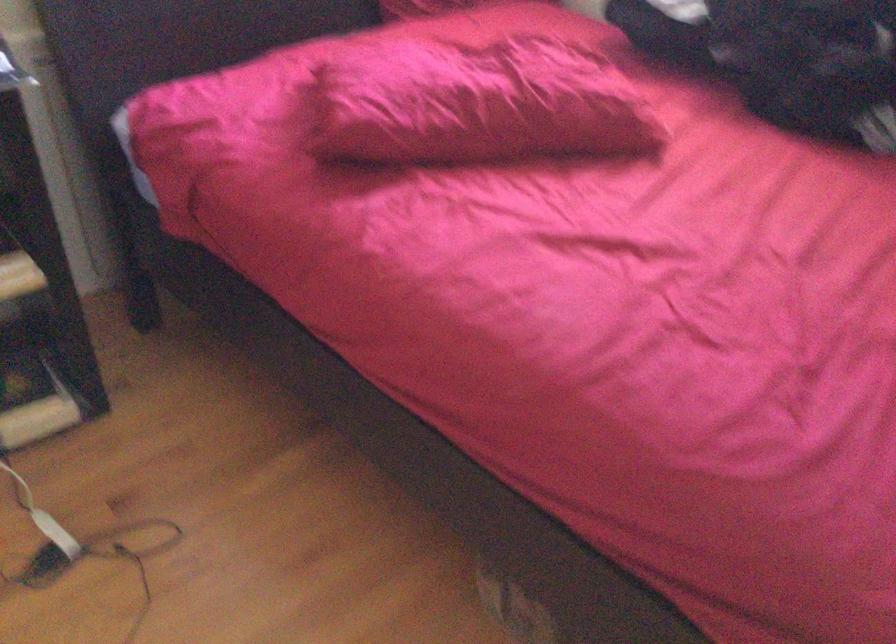
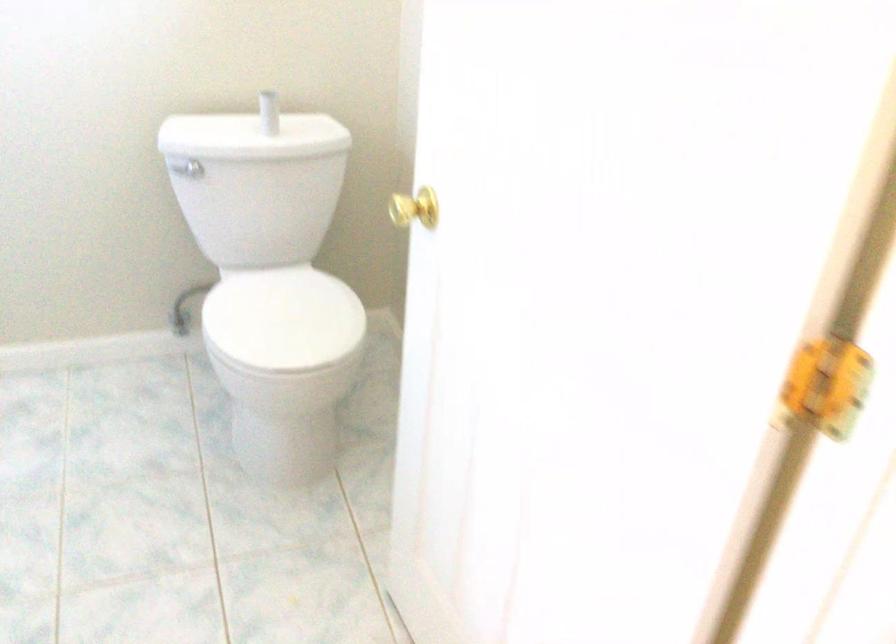
Question: The images are taken continuously from a first-person perspective. In which direction are you moving?

Choices:
 (A) Left
 (B) Right
 (C) Forward
 (D) Backward

Answer: (A)